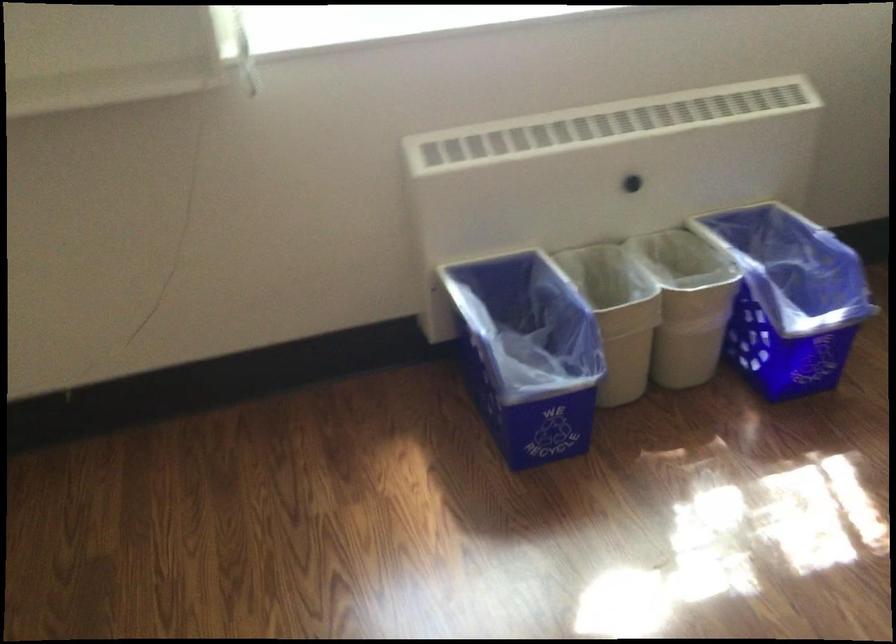
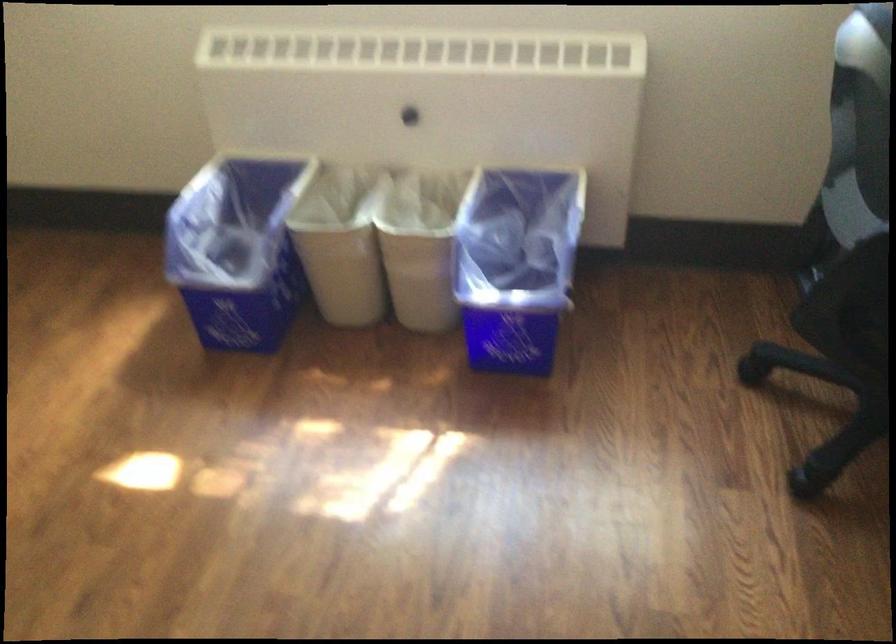
Locate, in the second image, the point that corresponds to point (513, 354) in the first image.

(237, 249)